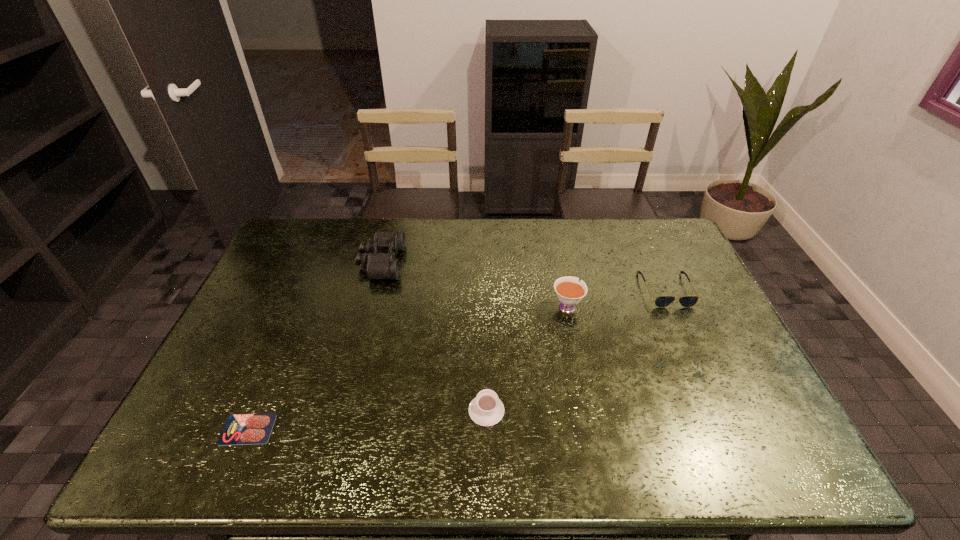
This screenshot has height=540, width=960. What are the coordinates of `object present at the right edge` in the screenshot? It's located at (662, 301).

Locate an element on the screen. This screenshot has height=540, width=960. object that is at the near left corner is located at coordinates (241, 429).

In the image, there is a desktop. Identify the location of vacant area at the far edge. (333, 234).

In the image, there is a desktop. Where is `vacant space at the near edge`? The image size is (960, 540). vacant space at the near edge is located at coordinates (414, 443).

In the image, there is a desktop. What are the coordinates of `vacant space at the left edge` in the screenshot? It's located at (229, 339).

The image size is (960, 540). I want to click on vacant region at the right edge of the desktop, so click(709, 377).

I want to click on free space at the far right corner of the desktop, so click(650, 226).

Locate an element on the screen. The image size is (960, 540). free point between the leftmost object and the fourth object from left to right is located at coordinates pyautogui.click(x=407, y=367).

Find the location of a particular element. The image size is (960, 540). free space between the salami and the fourth object from right to left is located at coordinates (315, 346).

At what (x,y) coordinates should I click in order to perform the action: click on free area in between the salami and the right teacup. Please return your answer as a coordinate pair (x, y). This screenshot has height=540, width=960. Looking at the image, I should click on (407, 367).